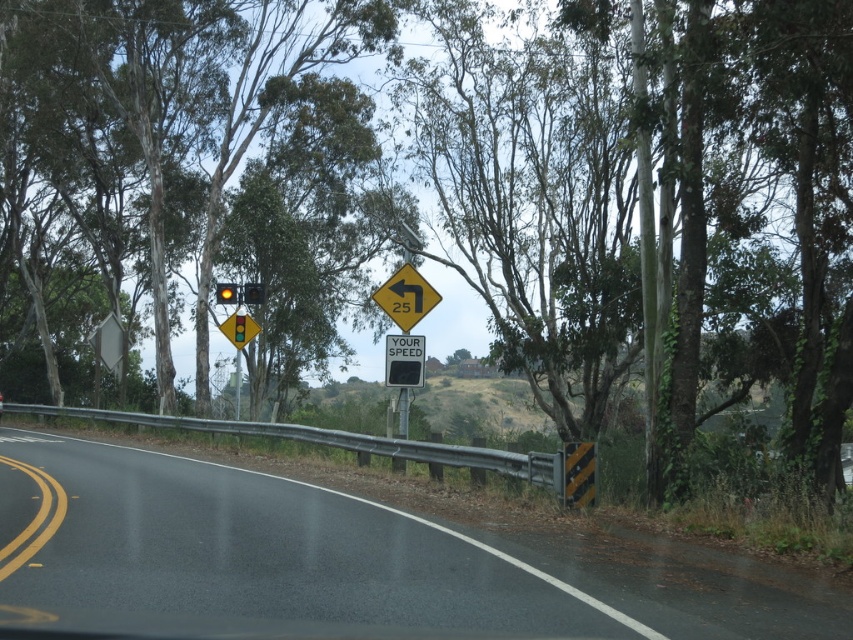
Question: Considering the real-world distances, which object is closest to the amber glass traffic light at upper center?

Choices:
 (A) green leafy tree at upper left
 (B) yellow plastic traffic light at upper center
 (C) black asphalt road at center

Answer: (B)

Question: Considering the real-world distances, which object is closest to the green leafy tree at upper left?

Choices:
 (A) amber glass traffic light at upper center
 (B) yellow reflective plastic at center

Answer: (A)

Question: Is green leafy tree at upper left above yellow plastic traffic light at upper center?

Choices:
 (A) no
 (B) yes

Answer: (B)

Question: Which point appears closest to the camera in this image?

Choices:
 (A) (196, 20)
 (B) (409, 264)
 (C) (399, 349)
 (D) (7, 557)

Answer: (D)

Question: Is green leafy tree at upper left smaller than amber glass traffic light at upper center?

Choices:
 (A) yes
 (B) no

Answer: (B)

Question: Does amber glass traffic light at upper center appear over yellow plastic traffic light at upper center?

Choices:
 (A) yes
 (B) no

Answer: (B)